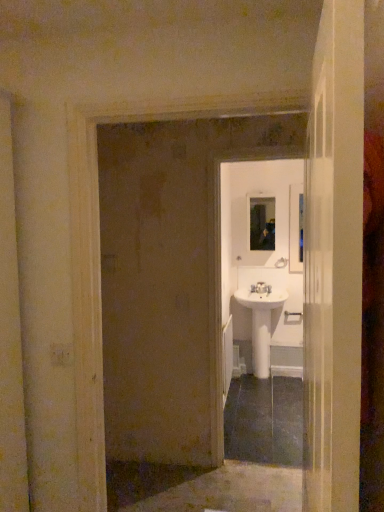
This screenshot has width=384, height=512. What do you see at coordinates (292, 314) in the screenshot?
I see `silver metallic door handle at center` at bounding box center [292, 314].

This screenshot has height=512, width=384. What do you see at coordinates (261, 322) in the screenshot?
I see `white ceramic sink at center` at bounding box center [261, 322].

What do you see at coordinates (262, 224) in the screenshot?
I see `metallic reflective mirror at center` at bounding box center [262, 224].

Image resolution: width=384 pixels, height=512 pixels. Identify the location of white glossy sink at center. [x=262, y=268].

Where is `silver metallic door handle at center`? The width and height of the screenshot is (384, 512). silver metallic door handle at center is located at coordinates (292, 314).

Is white glossy door at center not inside white ceramic sink at center?

Yes, white glossy door at center is not within white ceramic sink at center.

Can you confirm if white glossy door at center is smaller than white ceramic sink at center?

Indeed, white glossy door at center has a smaller size compared to white ceramic sink at center.

From the image's perspective, who appears lower, white glossy door at center or white ceramic sink at center?

From the image's view, white ceramic sink at center is below.

At what (x,y) coordinates should I click in order to perform the action: click on door above the white ceramic sink at center (from a real-world perspective). Please return your answer as a coordinate pair (x, y). The width and height of the screenshot is (384, 512). Looking at the image, I should click on (334, 262).

Consider the image. Is white glossy sink at center oriented away from white ceramic sink at center?

Yes, white glossy sink at center is positioned with its back facing white ceramic sink at center.

In the scene shown: Is white glossy sink at center located outside white ceramic sink at center?

Yes, white glossy sink at center is located beyond the bounds of white ceramic sink at center.

Considering the positions of points (267, 253) and (259, 347), is point (267, 253) farther from camera compared to point (259, 347)?

Yes, point (267, 253) is farther from viewer.

Does white glossy sink at center have a smaller size compared to white ceramic sink at center?

Yes, white glossy sink at center is smaller than white ceramic sink at center.

From the picture: Is white ceramic sink at center turned away from metallic reflective mirror at center?

No, white ceramic sink at center is not facing the opposite direction of metallic reflective mirror at center.

Between white ceramic sink at center and metallic reflective mirror at center, which one has larger size?

white ceramic sink at center is bigger.

How much distance is there between white ceramic sink at center and metallic reflective mirror at center?

The distance of white ceramic sink at center from metallic reflective mirror at center is 28.64 inches.

From the image's perspective, is white ceramic sink at center under metallic reflective mirror at center?

Yes, from the image's perspective, white ceramic sink at center is beneath metallic reflective mirror at center.

Who is shorter, white glossy sink at center or metallic reflective mirror at center?

With less height is metallic reflective mirror at center.

Considering the sizes of objects white glossy sink at center and metallic reflective mirror at center in the image provided, who is bigger, white glossy sink at center or metallic reflective mirror at center?

white glossy sink at center is bigger.

Which of these two, white glossy sink at center or metallic reflective mirror at center, is wider?

white glossy sink at center is wider.

How different are the orientations of white glossy sink at center and metallic reflective mirror at center in degrees?

There is a 1.08-degree angle between the facing directions of white glossy sink at center and metallic reflective mirror at center.

From the image's perspective, between white plastic light switch at lower left and white glossy door at center, who is located below?

white plastic light switch at lower left appears lower in the image.

Does white plastic light switch at lower left have a larger size compared to white glossy door at center?

Actually, white plastic light switch at lower left might be smaller than white glossy door at center.

Measure the distance from white plastic light switch at lower left to white glossy door at center.

white plastic light switch at lower left and white glossy door at center are 1.12 meters apart from each other.

Visually, is white plastic light switch at lower left positioned to the left or to the right of white glossy door at center?

white plastic light switch at lower left is to the left of white glossy door at center.

From a real-world perspective, is white ceramic sink at center on top of white glossy door at center?

No.

From the image's perspective, is white ceramic sink at center on top of white glossy door at center?

No, from the image's perspective, white ceramic sink at center is not above white glossy door at center.

Is white ceramic sink at center looking in the opposite direction of white glossy door at center?

No, white ceramic sink at center is not facing the opposite direction of white glossy door at center.

Which object is further away from the camera, white ceramic sink at center or white plastic light switch at lower left?

Positioned behind is white ceramic sink at center.

Between white ceramic sink at center and white plastic light switch at lower left, which one appears on the right side from the viewer's perspective?

Positioned to the right is white ceramic sink at center.

The image size is (384, 512). Find the location of `light switch on the left of white ceramic sink at center`. light switch on the left of white ceramic sink at center is located at coordinates (62, 354).

Can you confirm if white ceramic sink at center is taller than white plastic light switch at lower left?

Indeed, white ceramic sink at center has a greater height compared to white plastic light switch at lower left.

Image resolution: width=384 pixels, height=512 pixels. What are the coordinates of `sink behind the white glossy door at center` in the screenshot? It's located at (261, 322).

This screenshot has height=512, width=384. Identify the location of corridor above the white ceramic sink at center (from a real-world perspective). (262, 268).

Based on their spatial positions, is metallic reflective mirror at center or silver metallic door handle at center closer to white glossy door at center?

silver metallic door handle at center lies closer to white glossy door at center than the other object.

Estimate the real-world distances between objects in this image. Which object is closer to white ceramic sink at center, white plastic light switch at lower left or white glossy sink at center?

Based on the image, white glossy sink at center appears to be nearer to white ceramic sink at center.

Based on their spatial positions, is metallic reflective mirror at center or white plastic light switch at lower left closer to white glossy door at center?

white plastic light switch at lower left is closer to white glossy door at center.

Estimate the real-world distances between objects in this image. Which object is further from metallic reflective mirror at center, white glossy door at center or white plastic light switch at lower left?

white glossy door at center is further to metallic reflective mirror at center.

Based on their spatial positions, is white glossy door at center or silver metallic door handle at center further from white plastic light switch at lower left?

Among the two, silver metallic door handle at center is located further to white plastic light switch at lower left.

Based on their spatial positions, is white glossy sink at center or white plastic light switch at lower left closer to silver metallic door handle at center?

Among the two, white glossy sink at center is located nearer to silver metallic door handle at center.

Which object lies nearer to the anchor point white plastic light switch at lower left, white ceramic sink at center or metallic reflective mirror at center?

white ceramic sink at center is positioned closer to the anchor white plastic light switch at lower left.

From the image, which object appears to be nearer to white glossy door at center, white plastic light switch at lower left or white ceramic sink at center?

Based on the image, white plastic light switch at lower left appears to be nearer to white glossy door at center.

The height and width of the screenshot is (512, 384). What are the coordinates of `mirror between white glossy sink at center and silver metallic door handle at center in the front-back direction` in the screenshot? It's located at (262, 224).

The image size is (384, 512). In order to click on corridor between white plastic light switch at lower left and white ceramic sink at center in the front-back direction in this screenshot , I will do `click(262, 268)`.

The image size is (384, 512). I want to click on corridor between white plastic light switch at lower left and metallic reflective mirror at center from front to back, so click(x=262, y=268).

Locate an element on the screen. Image resolution: width=384 pixels, height=512 pixels. mirror between white plastic light switch at lower left and silver metallic door handle at center in the front-back direction is located at coordinates (262, 224).